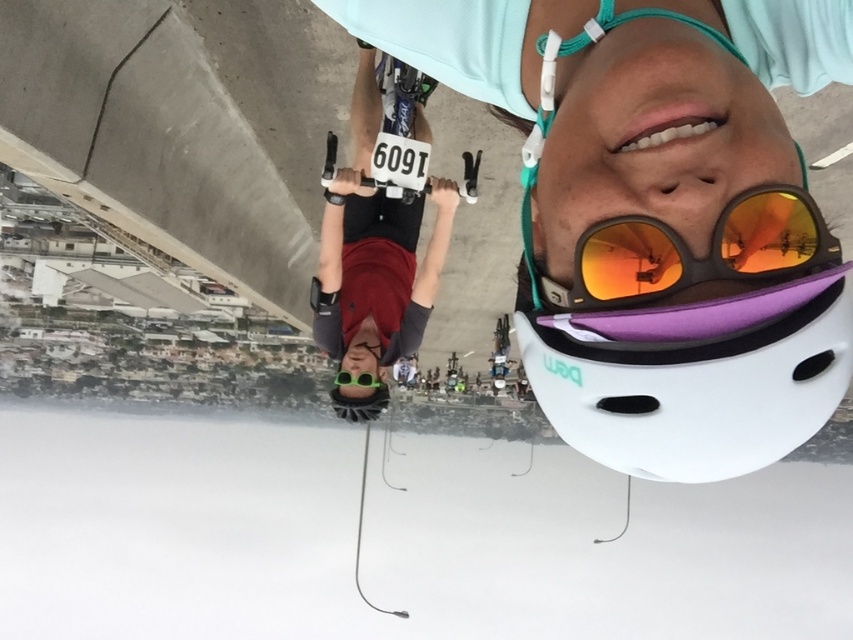
You are a cyclist navigating a busy city bridge. You notice two matte black helmets in your view. Which one is closer to you, the matte black helmet at upper center or the matte black helmet at center?

The matte black helmet at upper center is closer to the viewer than the matte black helmet at center.

You are navigating a bicycle path and need to decide which direction to turn next. You see two points marked in your vision, point (728, 230) and point (372, 376). Which point is closer to you?

Point (728, 230) is closer to the viewer than point (372, 376), so you should turn towards point (728, 230) first.